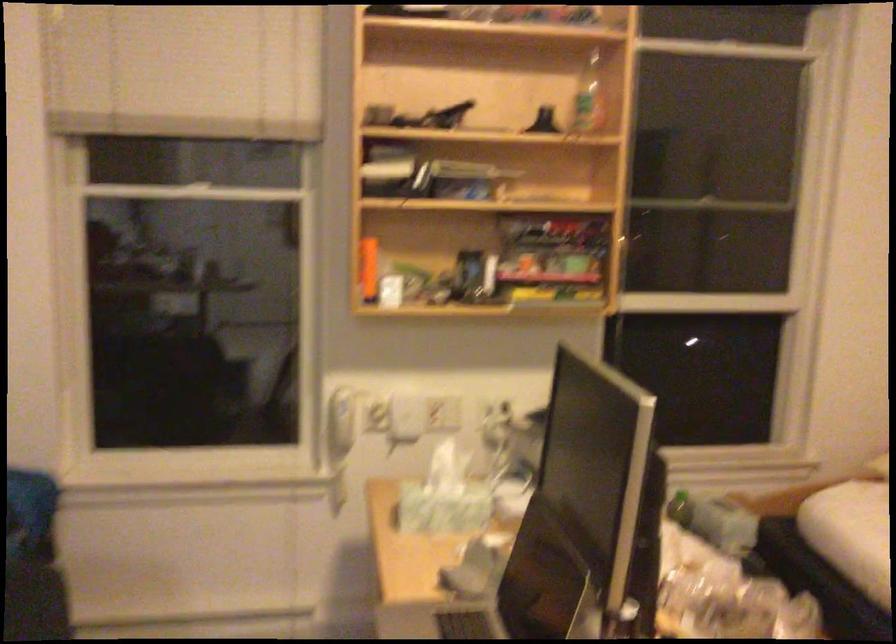
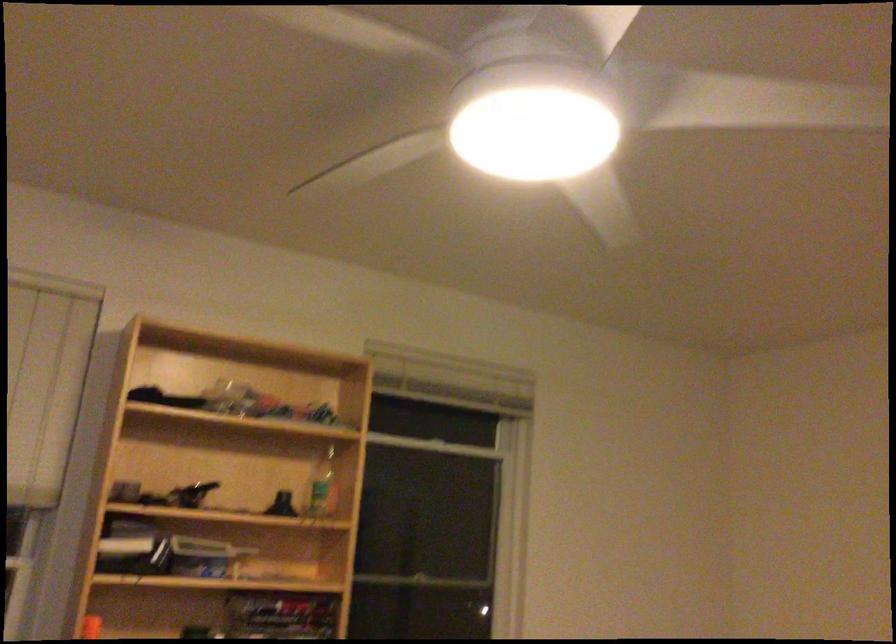
Locate, in the second image, the point that corresponds to [548,238] in the first image.

(281, 614)